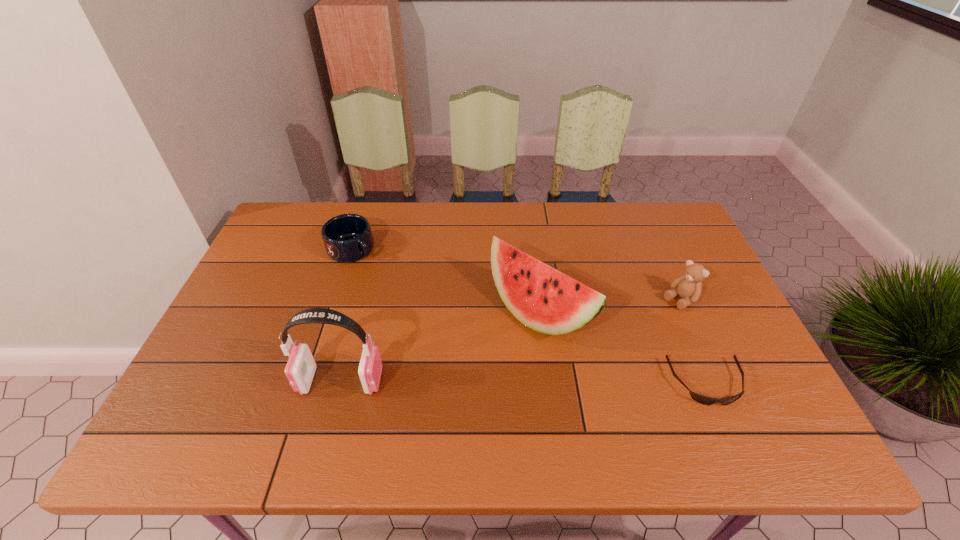
Find the location of a particular element. The width and height of the screenshot is (960, 540). free space on the desktop that is between the earphone and the shortest object and is positioned on the face of the teddy bear is located at coordinates (564, 382).

You are a GUI agent. You are given a task and a screenshot of the screen. Output one action in this format:
    pyautogui.click(x=<x>, y=<y>)
    Task: Click on the vacant space on the desktop that is between the tallest object and the shortest object and is positioned with the handle on the side of the fourth tallest object
    This screenshot has height=540, width=960.
    Given the screenshot: What is the action you would take?
    pyautogui.click(x=516, y=382)

You are a GUI agent. You are given a task and a screenshot of the screen. Output one action in this format:
    pyautogui.click(x=<x>, y=<y>)
    Task: Click on the vacant spot on the desktop that is between the earphone and the shortest object and is positioned on the outer rind of the watermelon
    Image resolution: width=960 pixels, height=540 pixels.
    Given the screenshot: What is the action you would take?
    pyautogui.click(x=470, y=382)